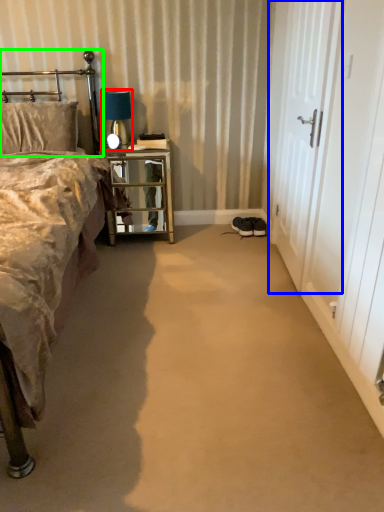
Question: Estimate the real-world distances between objects in this image. Which object is farther from table lamp (highlighted by a red box), screen door (highlighted by a blue box) or headboard (highlighted by a green box)?

Choices:
 (A) screen door
 (B) headboard

Answer: (A)